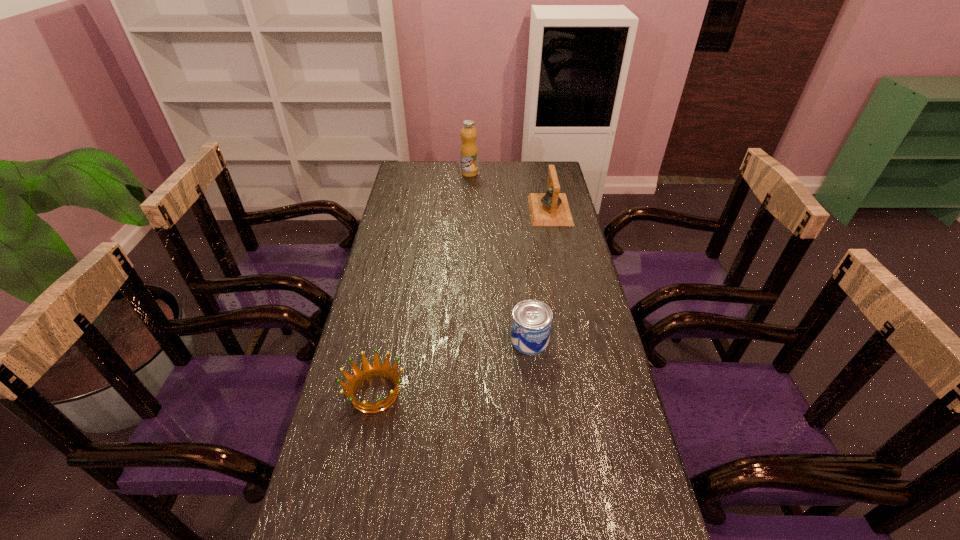
Locate an element on the screen. The height and width of the screenshot is (540, 960). vacant space located on the front label of the second shortest object is located at coordinates (542, 460).

At what (x,y) coordinates should I click in order to perform the action: click on vacant space located 0.170m on the front of the leftmost object. Please return your answer as a coordinate pair (x, y). This screenshot has height=540, width=960. Looking at the image, I should click on (354, 492).

At what (x,y) coordinates should I click in order to perform the action: click on object that is at the far edge. Please return your answer as a coordinate pair (x, y). Image resolution: width=960 pixels, height=540 pixels. Looking at the image, I should click on (469, 151).

Locate an element on the screen. This screenshot has width=960, height=540. object located at the left edge is located at coordinates (368, 371).

Locate an element on the screen. The height and width of the screenshot is (540, 960). object positioned at the right edge is located at coordinates (551, 208).

Identify the location of vacant space at the far edge of the desktop. The image size is (960, 540). (503, 164).

You are a GUI agent. You are given a task and a screenshot of the screen. Output one action in this format:
    pyautogui.click(x=<x>, y=<y>)
    Task: Click on the vacant region at the left edge
    This screenshot has width=960, height=540.
    Given the screenshot: What is the action you would take?
    pyautogui.click(x=357, y=333)

I want to click on vacant space at the right edge of the desktop, so click(542, 193).

Where is `free space at the far left corner of the desktop`? This screenshot has width=960, height=540. free space at the far left corner of the desktop is located at coordinates (427, 183).

Find the location of a particular element. free spot at the far right corner of the desktop is located at coordinates point(535,178).